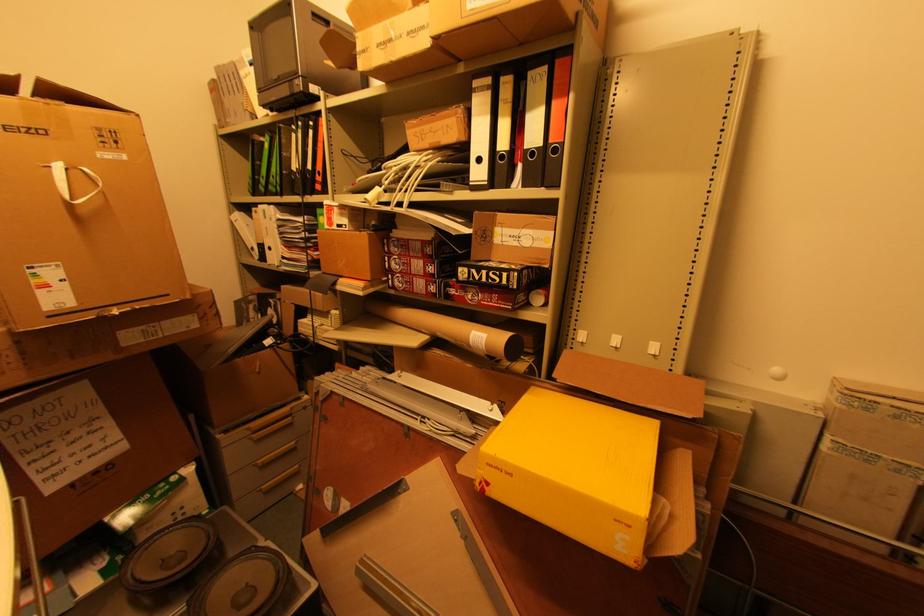
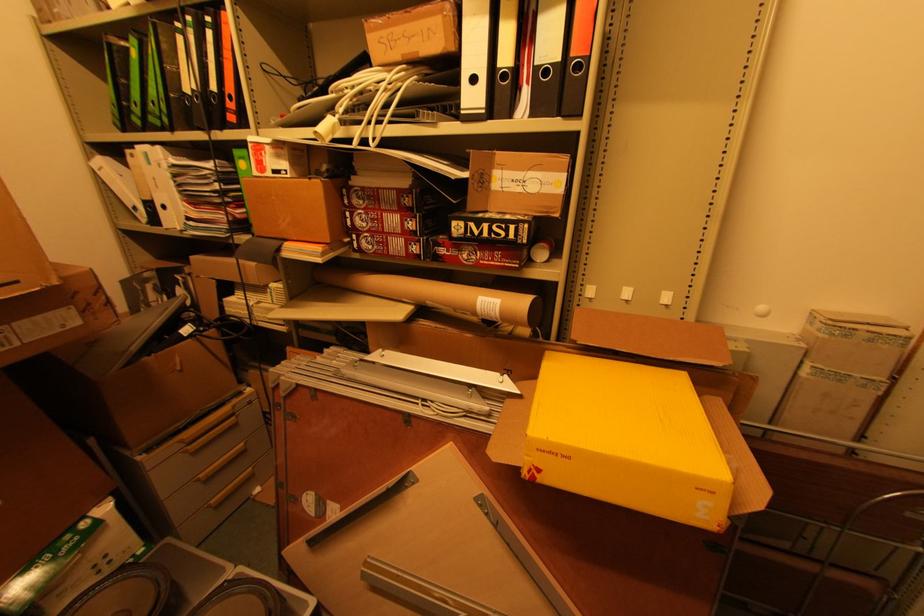
Question: How did the camera likely rotate?

Choices:
 (A) Left
 (B) Right
 (C) Up
 (D) Down

Answer: (B)